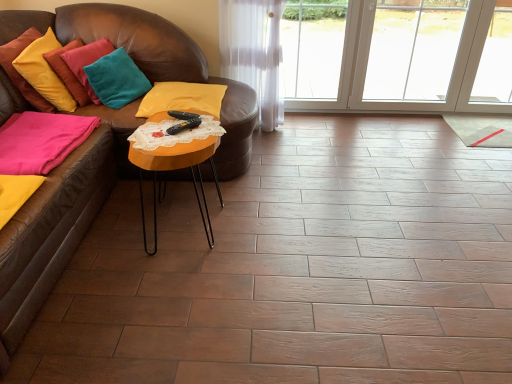
Question: From a real-world perspective, is pink fabric pillow at lower left, which is the third pillow in right-to-left order, positioned above or below velvet yellow pillow at upper left, the fourth pillow viewed from the right?

Choices:
 (A) below
 (B) above

Answer: (A)

Question: Which is correct: pink fabric pillow at lower left, which is the third pillow in right-to-left order, is inside velvet yellow pillow at upper left, which is the 1th pillow from left to right, or outside of it?

Choices:
 (A) outside
 (B) inside

Answer: (A)

Question: Based on their relative distances, which object is nearer to the velvet yellow pillow at upper left, which is the 1th pillow from left to right?

Choices:
 (A) teal velvet pillow at upper left, which is the 3th pillow from left to right
 (B) orange wood table at center
 (C) pink fabric pillow at lower left, which is the third pillow in right-to-left order
 (D) yellow velvet pillow at center, which is the 4th pillow in left-to-right order

Answer: (A)

Question: Which of these objects is positioned farthest from the velvet yellow pillow at upper left, the fourth pillow viewed from the right?

Choices:
 (A) yellow velvet pillow at center, positioned as the first pillow in right-to-left order
 (B) pink fabric pillow at lower left, the second pillow from the left
 (C) teal velvet pillow at upper left, which ranks as the second pillow in right-to-left order
 (D) orange wood table at center

Answer: (D)